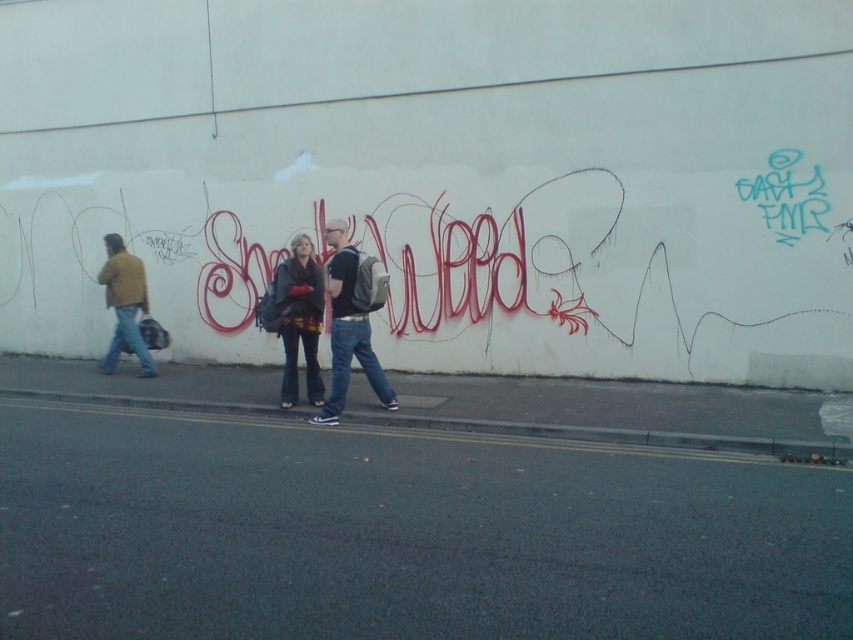
Who is more distant from viewer, (343, 308) or (125, 278)?

The point (125, 278) is more distant.

Can you confirm if matte black backpack at center is thinner than matte yellow jacket at left?

Yes, matte black backpack at center is thinner than matte yellow jacket at left.

Who is more forward, (357, 268) or (111, 365)?

Point (357, 268) is more forward.

At what (x,y) coordinates should I click in order to perform the action: click on matte black backpack at center. Please return your answer as a coordinate pair (x, y). This screenshot has height=640, width=853. Looking at the image, I should click on (352, 320).

Does point (341, 272) come behind point (302, 307)?

No.

Is point (347, 292) positioned before point (316, 272)?

Yes, it is.

Locate an element on the screen. matte black backpack at center is located at coordinates (352, 320).

Is point (283, 296) closer to camera compared to point (107, 304)?

Yes, it is in front of point (107, 304).

Can you confirm if matte black jacket at center is positioned to the right of matte yellow jacket at left?

Indeed, matte black jacket at center is positioned on the right side of matte yellow jacket at left.

Who is more forward, (316, 355) or (128, 323)?

Point (316, 355) is more forward.

You are a GUI agent. You are given a task and a screenshot of the screen. Output one action in this format:
    pyautogui.click(x=<x>, y=<y>)
    Task: Click on the matte black jacket at center
    Image resolution: width=853 pixels, height=640 pixels.
    Given the screenshot: What is the action you would take?
    click(x=299, y=317)